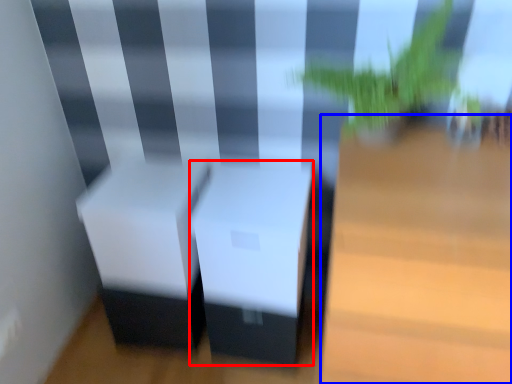
Question: Which point is closer to the camera, table (highlighted by a red box) or table (highlighted by a blue box)?

Choices:
 (A) table
 (B) table

Answer: (B)